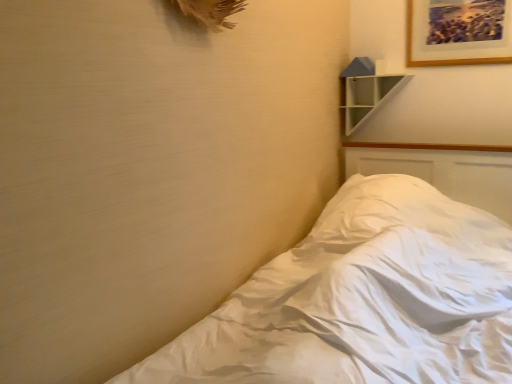
Question: Is white glossy shelf at upper right to the left or to the right of white soft bed at lower right in the image?

Choices:
 (A) right
 (B) left

Answer: (A)

Question: From the image's perspective, relative to white soft bed at lower right, is white glossy shelf at upper right above or below?

Choices:
 (A) below
 (B) above

Answer: (B)

Question: Estimate the real-world distances between objects in this image. Which object is closer to the white soft bed at lower right?

Choices:
 (A) wooden picture frame at upper right
 (B) white glossy shelf at upper right

Answer: (B)

Question: Considering the real-world distances, which object is closest to the white soft bed at lower right?

Choices:
 (A) wooden picture frame at upper right
 (B) white glossy shelf at upper right

Answer: (B)